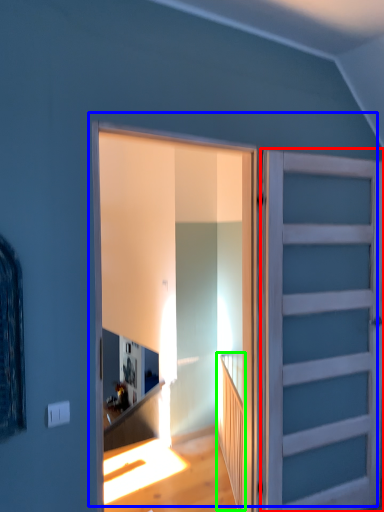
Question: Considering the real-world distances, which object is farthest from door (highlighted by a red box)? door (highlighted by a blue box) or stairwell (highlighted by a green box)?

Choices:
 (A) door
 (B) stairwell

Answer: (B)